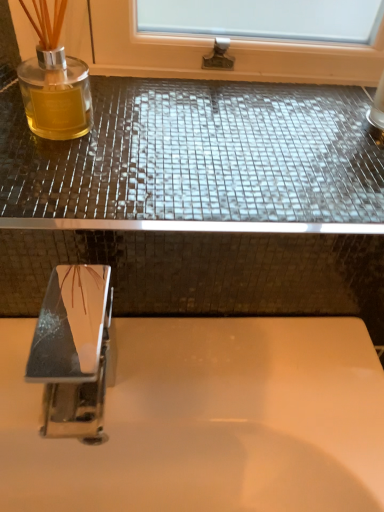
Where is `free location to the right of polished chrome tap at lower left`? This screenshot has height=512, width=384. free location to the right of polished chrome tap at lower left is located at coordinates (241, 387).